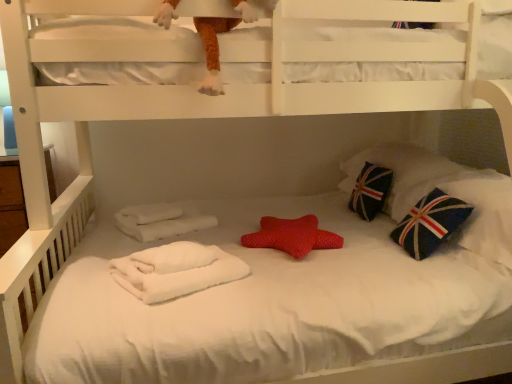
Locate an element on the screen. fuzzy orange plush at upper center is located at coordinates (217, 42).

The image size is (512, 384). What do you see at coordinates (217, 42) in the screenshot?
I see `fuzzy orange plush at upper center` at bounding box center [217, 42].

Where is `dark blue fabric pillow with union jack design at right, which is counted as the 2th pillow, starting from the back`? The width and height of the screenshot is (512, 384). dark blue fabric pillow with union jack design at right, which is counted as the 2th pillow, starting from the back is located at coordinates tap(446, 192).

You are a GUI agent. You are given a task and a screenshot of the screen. Output one action in this format:
    pyautogui.click(x=<x>, y=<y>)
    Task: Click on the 1st pillow behind when counting from the fuzzy orange plush at upper center
    The height and width of the screenshot is (384, 512).
    Given the screenshot: What is the action you would take?
    pyautogui.click(x=446, y=192)

Based on the photo, which is closer to the camera, (208, 69) or (510, 182)?

Positioned in front is point (208, 69).

What's the angular difference between fuzzy orange plush at upper center and dark blue fabric pillow with union jack design at right, which is counted as the 2th pillow, starting from the back,'s facing directions?

87.8 degrees separate the facing orientations of fuzzy orange plush at upper center and dark blue fabric pillow with union jack design at right, which is counted as the 2th pillow, starting from the back.

From a real-world perspective, is fuzzy orange plush at upper center physically below dark blue fabric pillow with union jack design at right, which is counted as the 2th pillow, starting from the back?

Actually, fuzzy orange plush at upper center is physically above dark blue fabric pillow with union jack design at right, which is counted as the 2th pillow, starting from the back, in the real world.

Identify the location of throw pillow below the fuzzy orange plush at upper center (from the image's perspective). The height and width of the screenshot is (384, 512). (292, 236).

Is fuzzy orange plush at upper center facing away from rubber star at center?

No.

Is fuzzy orange plush at upper center thinner than rubber star at center?

Indeed, fuzzy orange plush at upper center has a lesser width compared to rubber star at center.

How different are the orientations of fuzzy orange plush at upper center and rubber star at center in degrees?

88.3 degrees.

Which object is closer to the camera, blue fabric pillow with union jack design at right, marked as the second pillow in a front-to-back arrangement, or white fluffy towel at lower left?

white fluffy towel at lower left is closer to the camera.

Is white fluffy towel at lower left completely or partially inside blue fabric pillow with union jack design at right, positioned as the 1th pillow in back-to-front order?

No.

Is blue fabric pillow with union jack design at right, positioned as the 1th pillow in back-to-front order, next to white fluffy towel at lower left?

There is a gap between blue fabric pillow with union jack design at right, positioned as the 1th pillow in back-to-front order, and white fluffy towel at lower left.

Does point (379, 153) lie behind point (116, 260)?

Yes, it is behind point (116, 260).

How much distance is there between blue fabric pillow with union jack design at right, marked as the second pillow in a front-to-back arrangement, and dark blue fabric pillow with union jack design at right, which is counted as the 2th pillow, starting from the back?

A distance of 1.97 inches exists between blue fabric pillow with union jack design at right, marked as the second pillow in a front-to-back arrangement, and dark blue fabric pillow with union jack design at right, which is counted as the 2th pillow, starting from the back.

From a real-world perspective, is blue fabric pillow with union jack design at right, positioned as the 1th pillow in back-to-front order, beneath dark blue fabric pillow with union jack design at right, which is counted as the 2th pillow, starting from the back?

Actually, blue fabric pillow with union jack design at right, positioned as the 1th pillow in back-to-front order, is physically above dark blue fabric pillow with union jack design at right, which is counted as the 2th pillow, starting from the back, in the real world.

This screenshot has height=384, width=512. Find the location of `pillow behind the dark blue fabric pillow with union jack design at right, the first pillow positioned from the front`. pillow behind the dark blue fabric pillow with union jack design at right, the first pillow positioned from the front is located at coordinates (402, 173).

Does point (247, 267) lie in front of point (334, 246)?

Yes, point (247, 267) is in front of point (334, 246).

Between white fluffy towel at lower left and rubber star at center, which one has smaller size?

white fluffy towel at lower left is smaller.

Between white fluffy towel at lower left and rubber star at center, which one has less height?

white fluffy towel at lower left is shorter.

Is white fluffy towel at lower left positioned far away from rubber star at center?

No, white fluffy towel at lower left is not far from rubber star at center.

From the picture: Considering the relative sizes of white fluffy towel at lower left and fuzzy orange plush at upper center in the image provided, is white fluffy towel at lower left shorter than fuzzy orange plush at upper center?

Correct, white fluffy towel at lower left is not as tall as fuzzy orange plush at upper center.

Can you tell me how much white fluffy towel at lower left and fuzzy orange plush at upper center differ in facing direction?

The angle between the facing direction of white fluffy towel at lower left and the facing direction of fuzzy orange plush at upper center is 62.4 degrees.

Does white fluffy towel at lower left have a greater width compared to fuzzy orange plush at upper center?

Yes, white fluffy towel at lower left is wider than fuzzy orange plush at upper center.

From the image's perspective, is white fluffy towel at lower left over fuzzy orange plush at upper center?

No.

Is dark blue fabric pillow with union jack design at right, which is counted as the 2th pillow, starting from the back, completely or partially outside of white fluffy towel at lower left?

That's correct, dark blue fabric pillow with union jack design at right, which is counted as the 2th pillow, starting from the back, is outside of white fluffy towel at lower left.

Considering the sizes of objects dark blue fabric pillow with union jack design at right, which is counted as the 2th pillow, starting from the back, and white fluffy towel at lower left in the image provided, who is smaller, dark blue fabric pillow with union jack design at right, which is counted as the 2th pillow, starting from the back, or white fluffy towel at lower left?

Smaller between the two is white fluffy towel at lower left.

Identify the location of material in front of the dark blue fabric pillow with union jack design at right, the first pillow positioned from the front. (175, 270).

Is dark blue fabric pillow with union jack design at right, which is counted as the 2th pillow, starting from the back, in front of or behind white fluffy towel at lower left in the image?

dark blue fabric pillow with union jack design at right, which is counted as the 2th pillow, starting from the back, is positioned farther from the viewer than white fluffy towel at lower left.

Where is `the 1st pillow behind the fuzzy orange plush at upper center, starting your count from the anchor`? The width and height of the screenshot is (512, 384). the 1st pillow behind the fuzzy orange plush at upper center, starting your count from the anchor is located at coordinates (446, 192).

At what (x,y) coordinates should I click in order to perform the action: click on throw pillow located on the right of fuzzy orange plush at upper center. Please return your answer as a coordinate pair (x, y). The height and width of the screenshot is (384, 512). Looking at the image, I should click on (x=292, y=236).

When comparing their distances from blue fabric pillow with union jack design at right, positioned as the 1th pillow in back-to-front order, does dark blue fabric pillow with union jack design at right, the first pillow positioned from the front, or rubber star at center seem further?

The object further to blue fabric pillow with union jack design at right, positioned as the 1th pillow in back-to-front order, is rubber star at center.

Based on their spatial positions, is white fluffy towel at lower left or rubber star at center closer to blue fabric pillow with union jack design at right, positioned as the 1th pillow in back-to-front order?

rubber star at center lies closer to blue fabric pillow with union jack design at right, positioned as the 1th pillow in back-to-front order, than the other object.

Looking at the image, which one is located further to rubber star at center, dark blue fabric pillow with union jack design at right, which is counted as the 2th pillow, starting from the back, or white fluffy towel at lower left?

dark blue fabric pillow with union jack design at right, which is counted as the 2th pillow, starting from the back, is positioned further to the anchor rubber star at center.

Looking at the image, which one is located closer to dark blue fabric pillow with union jack design at right, the first pillow positioned from the front, fuzzy orange plush at upper center or white fluffy towel at lower left?

white fluffy towel at lower left.

Looking at this image, from the image, which object appears to be nearer to white fluffy towel at lower left, dark blue fabric pillow with union jack design at right, the first pillow positioned from the front, or blue fabric pillow with union jack design at right, positioned as the 1th pillow in back-to-front order?

Among the two, dark blue fabric pillow with union jack design at right, the first pillow positioned from the front, is located nearer to white fluffy towel at lower left.

Based on their spatial positions, is blue fabric pillow with union jack design at right, positioned as the 1th pillow in back-to-front order, or fuzzy orange plush at upper center closer to dark blue fabric pillow with union jack design at right, the first pillow positioned from the front?

blue fabric pillow with union jack design at right, positioned as the 1th pillow in back-to-front order, is closer to dark blue fabric pillow with union jack design at right, the first pillow positioned from the front.

Based on their spatial positions, is rubber star at center or blue fabric pillow with union jack design at right, positioned as the 1th pillow in back-to-front order, closer to fuzzy orange plush at upper center?

Among the two, rubber star at center is located nearer to fuzzy orange plush at upper center.

Which object lies further to the anchor point rubber star at center, fuzzy orange plush at upper center or blue fabric pillow with union jack design at right, marked as the second pillow in a front-to-back arrangement?

fuzzy orange plush at upper center lies further to rubber star at center than the other object.

Identify the location of throw pillow located between white fluffy towel at lower left and dark blue fabric pillow with union jack design at right, which is counted as the 2th pillow, starting from the back, in the left-right direction. (292, 236).

Locate an element on the screen. This screenshot has width=512, height=384. throw pillow situated between white fluffy towel at lower left and blue fabric pillow with union jack design at right, marked as the second pillow in a front-to-back arrangement, from left to right is located at coordinates (292, 236).

The height and width of the screenshot is (384, 512). I want to click on throw pillow between fuzzy orange plush at upper center and white fluffy towel at lower left in the vertical direction, so click(292, 236).

Locate an element on the screen. This screenshot has width=512, height=384. throw pillow between fuzzy orange plush at upper center and blue fabric pillow with union jack design at right, marked as the second pillow in a front-to-back arrangement is located at coordinates (292, 236).